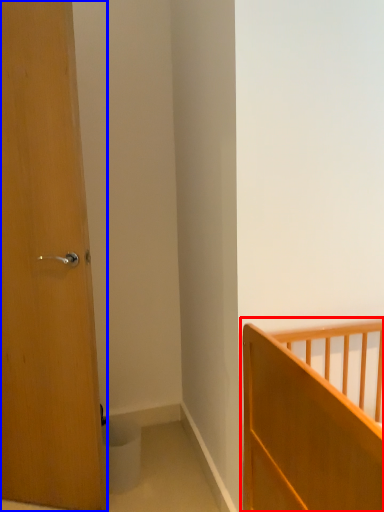
Question: Which of the following is the farthest to the observer, bed (highlighted by a red box) or door (highlighted by a blue box)?

Choices:
 (A) bed
 (B) door

Answer: (B)